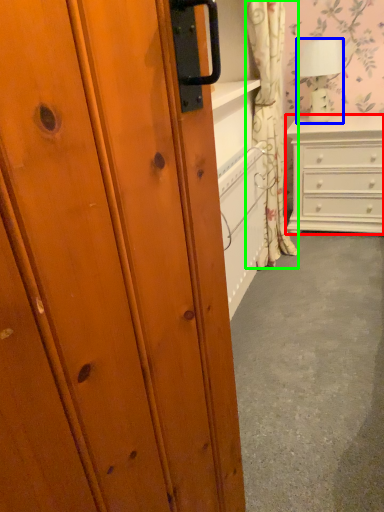
Question: Which is farther away from chest of drawers (highlighted by a red box)? lamp (highlighted by a blue box) or curtain (highlighted by a green box)?

Choices:
 (A) lamp
 (B) curtain

Answer: (B)